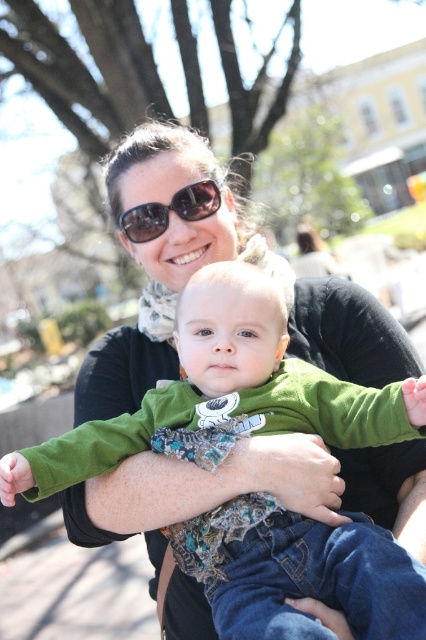
Could you measure the distance between green soft fabric baby at center and black reflective sunglasses at upper center?

The distance of green soft fabric baby at center from black reflective sunglasses at upper center is 65.66 centimeters.

Does green soft fabric baby at center have a smaller size compared to black reflective sunglasses at upper center?

Actually, green soft fabric baby at center might be larger than black reflective sunglasses at upper center.

Find the location of `green soft fabric baby at center`. green soft fabric baby at center is located at coordinates (224, 394).